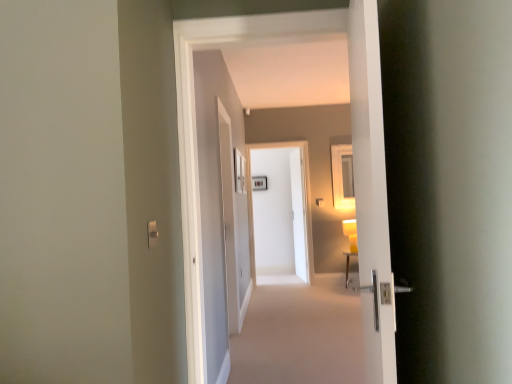
Question: Is white glossy door at center, which is counted as the first door, starting from the front, situated inside satin silver switch at lower left or outside?

Choices:
 (A) outside
 (B) inside

Answer: (A)

Question: From the image's perspective, is white glossy door at center, which is counted as the first door, starting from the front, positioned above or below satin silver switch at lower left?

Choices:
 (A) above
 (B) below

Answer: (A)

Question: Which is farther from the white glossy door handle at right?

Choices:
 (A) white glossy screen door at center
 (B) white glossy door at center, the first door viewed from the back
 (C) yellow matte lamp at right
 (D) white glossy door at center, which is counted as the first door, starting from the front
 (E) satin silver switch at lower left

Answer: (E)

Question: Estimate the real-world distances between objects in this image. Which object is farther from the white glossy door at center, which is the 2th door from back to front?

Choices:
 (A) white glossy door handle at right
 (B) white glossy door at center, which appears as the second door when viewed from the front
 (C) white glossy screen door at center
 (D) yellow matte lamp at right
 (E) satin silver switch at lower left

Answer: (C)